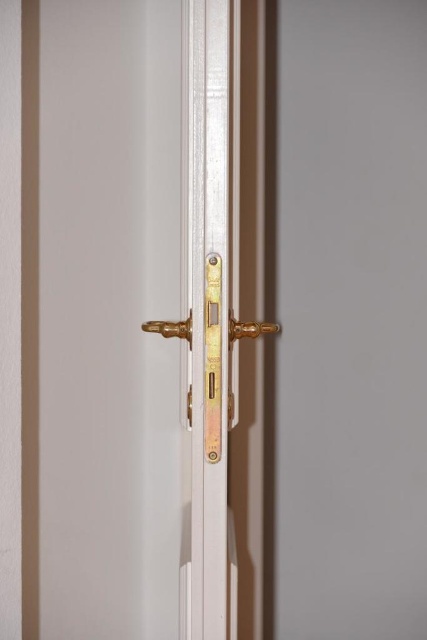
You are standing in front of the white door with brass hardware. You need to reach the point at coordinates point (169, 552) on the door. If your arm can extend 1.5 meters, can you reach it?

The point (169, 552) is 1.86 meters away from you. Since your arm can only extend 1.5 meters, you cannot reach it.

You are a delivery person holding a large package that is 40 inches wide. You approach the white glossy door handle at center to deliver the package. Can you reach the handle without moving the package?

The white glossy door handle at center is 38.46 inches from the camera. Since the package is 40 inches wide, it is wider than the distance to the handle, so you cannot reach the handle without moving the package.

You are a locksmith trying to install a new handle on a door. The existing handles are the gold polished door handle at center and the gold metallic door handle at center. Which handle has a greater width?

The gold polished door handle at center has a greater width than the gold metallic door handle at center according to the description.